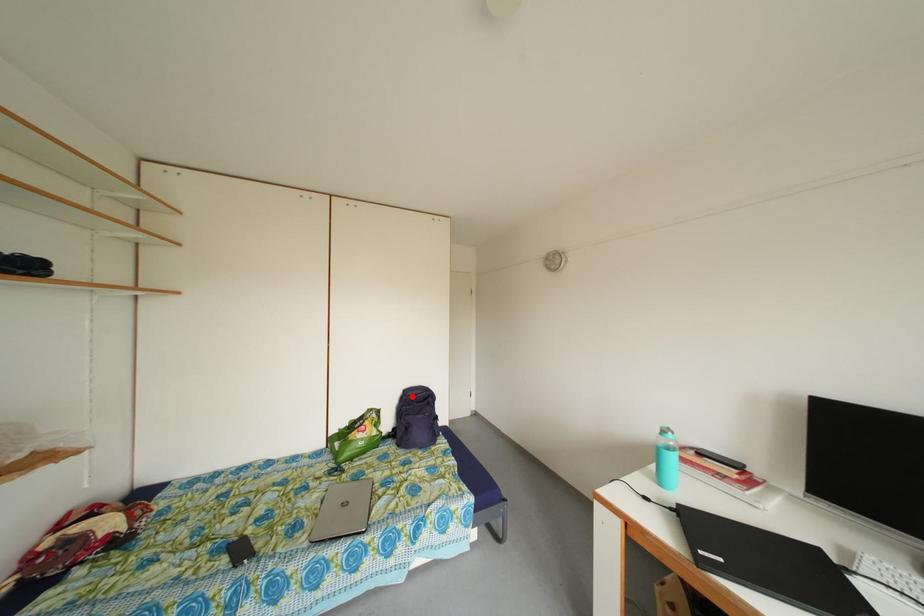
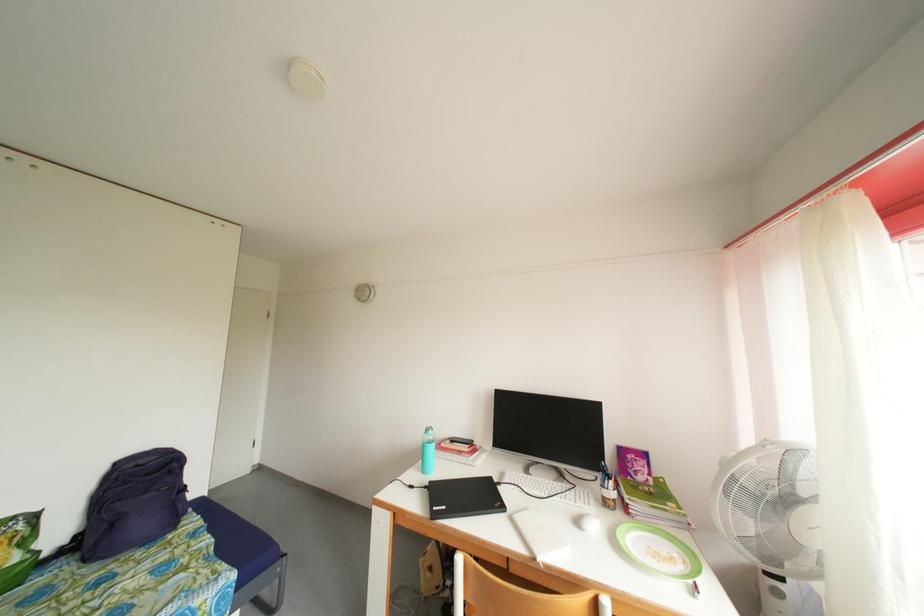
Question: I am providing you with two images of the same scene from different viewpoints. Given a red point in image1, look at the same physical point in image2. Is it:

Choices:
 (A) Closer to the viewpoint
 (B) Farther from the viewpoint

Answer: (A)